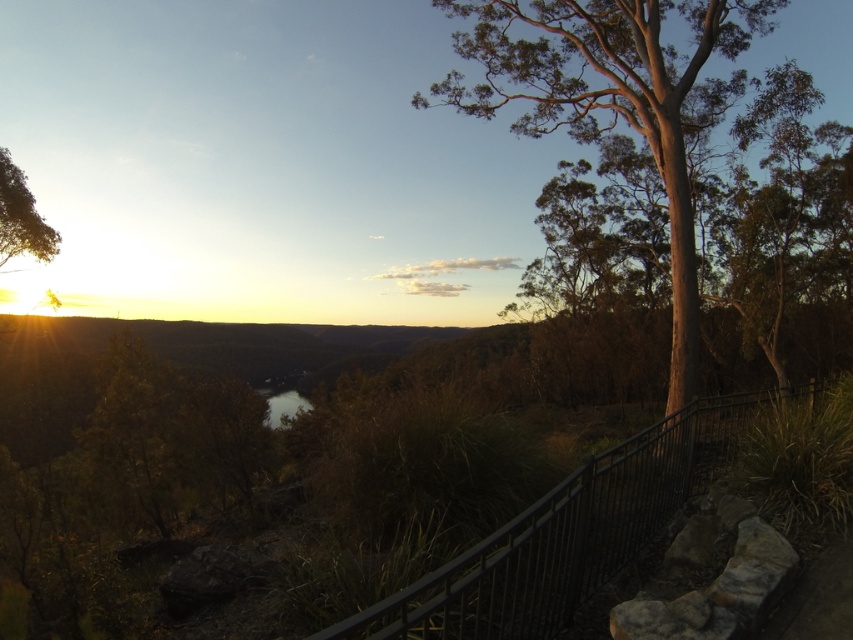
From the picture: You are a hiker who wants to take a photo of the smooth bark tree at right and the dark reflective water at center. Which object will appear larger in the photo?

The smooth bark tree at right will appear larger in the photo because it is closer to the camera than the dark reflective water at center.